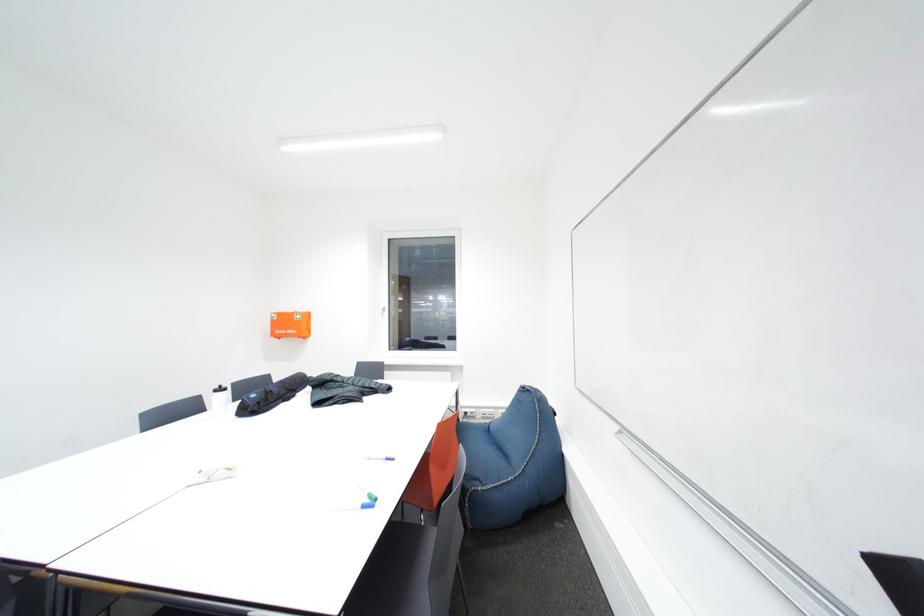
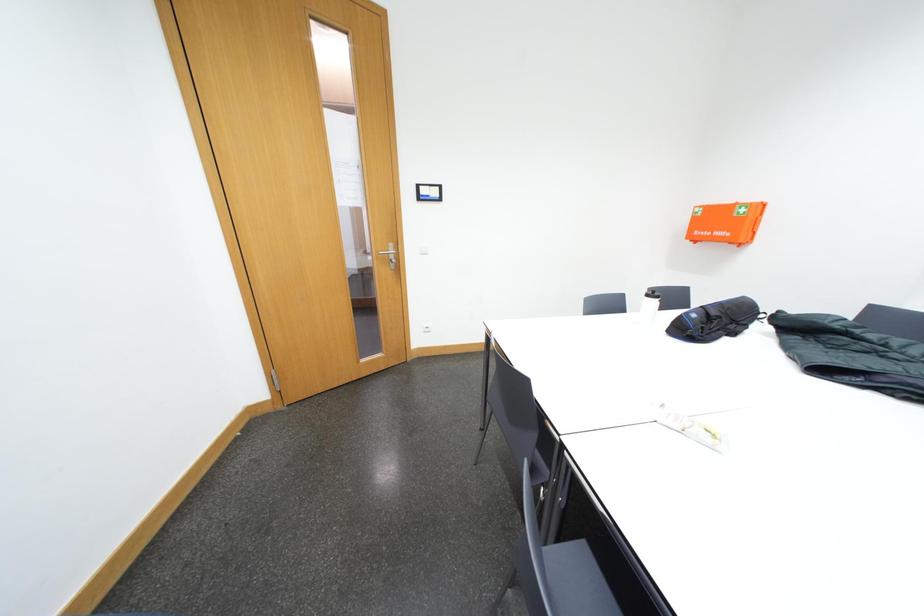
Consider the image. First-person continuous shooting, in which direction is the camera rotating?

The camera rotated toward left-down.